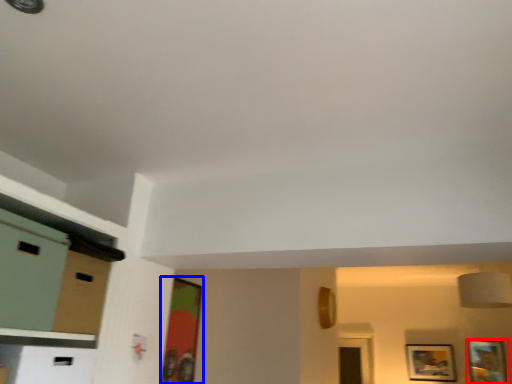
Question: Among these objects, which one is farthest to the camera, picture frame (highlighted by a red box) or picture frame (highlighted by a blue box)?

Choices:
 (A) picture frame
 (B) picture frame

Answer: (A)